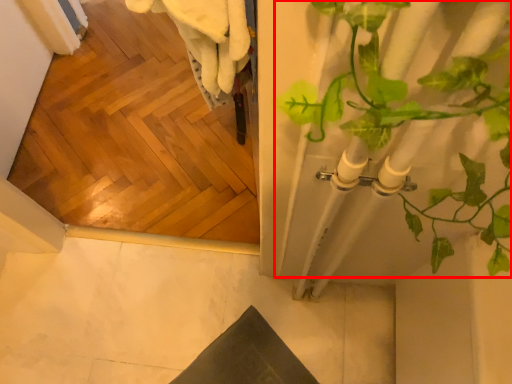
Question: Observing the image, what is the correct spatial positioning of houseplant (annotated by the red box) in reference to concrete?

Choices:
 (A) left
 (B) right

Answer: (B)